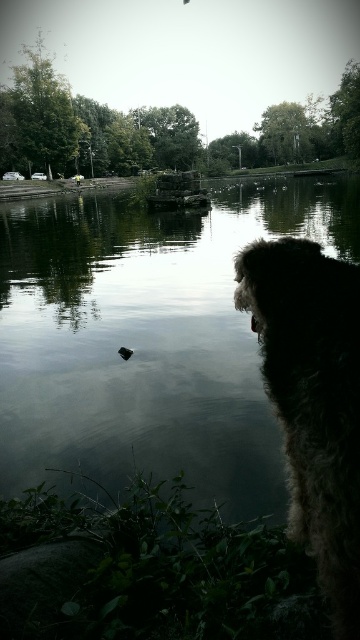
You are a photographer trying to capture the reflection of the trees in the water. The smooth reflective water at center and the fuzzy brown dog at right are both in the frame. Which object is larger in the current composition?

The smooth reflective water at center is bigger than the fuzzy brown dog at right, so it will dominate the reflection in the composition.

You are a photographer trying to capture the reflection of the trees in the water. The fuzzy brown dog at right is blocking your view. Can you move the dog to the left to get a clearer reflection of the trees in the smooth reflective water at center?

The smooth reflective water at center is much taller than the fuzzy brown dog at right, so moving the dog to the left might not significantly improve the reflection since the water is already taller. However, repositioning the dog could allow for a clearer view of the water surface.

You are a photographer trying to capture the reflection of the trees in the water. The fuzzy brown dog at right is blocking your view. Can you move the dog to the left to get a clearer shot of the reflection in the smooth reflective water at center?

The smooth reflective water at center is above the fuzzy brown dog at right, so moving the dog to the left would allow you to see the reflection in the smooth reflective water at center without obstruction.